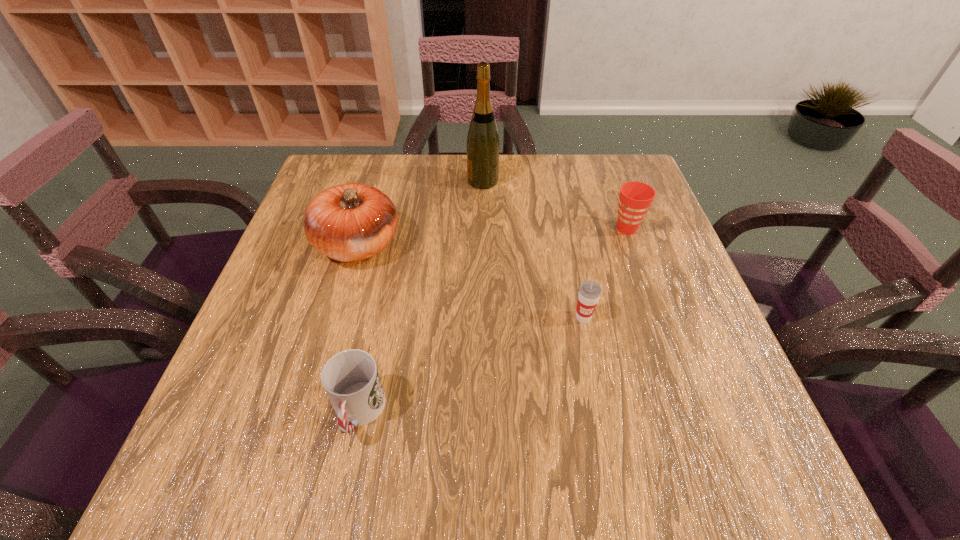
The image size is (960, 540). What are the coordinates of `free space that satisfies the following two spatial constraints: 1. on the front-facing side of the tallest object; 2. on the front side of the second tallest object` in the screenshot? It's located at (484, 245).

The image size is (960, 540). I want to click on vacant space that satisfies the following two spatial constraints: 1. on the front-facing side of the farthest object; 2. on the right side of the farthest cup, so click(x=483, y=229).

This screenshot has width=960, height=540. What are the coordinates of `free space that satisfies the following two spatial constraints: 1. on the back side of the farthest cup; 2. on the right side of the pumpkin` in the screenshot? It's located at (363, 229).

Identify the location of free space that satisfies the following two spatial constraints: 1. on the back side of the farthest cup; 2. on the right side of the pumpkin. Image resolution: width=960 pixels, height=540 pixels. (363, 229).